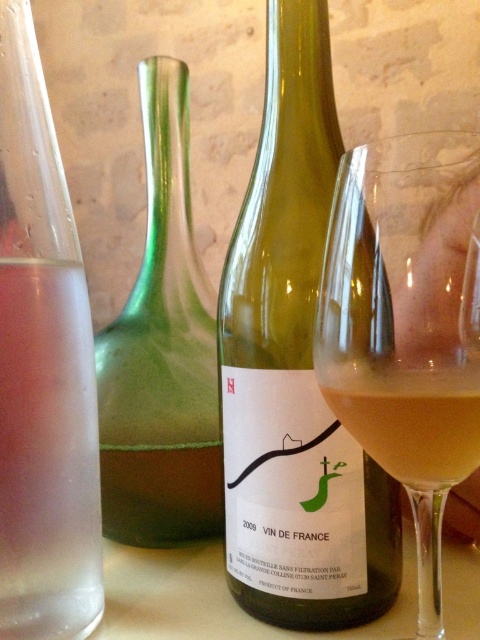
Can you confirm if transparent glass at left is bigger than green glass bottle at center?

Actually, transparent glass at left might be smaller than green glass bottle at center.

Based on the photo, who is more distant from viewer, (82, 356) or (162, 452)?

→ The point (162, 452) is more distant.

Image resolution: width=480 pixels, height=640 pixels. Identify the location of transparent glass at left. (43, 369).

From the picture: Who is shorter, green glass bottle at center or pale yellow liquid at glass right?

pale yellow liquid at glass right

You are a GUI agent. You are given a task and a screenshot of the screen. Output one action in this format:
    pyautogui.click(x=<x>, y=<y>)
    Task: Click on the green glass bottle at center
    The width and height of the screenshot is (480, 640).
    Given the screenshot: What is the action you would take?
    coord(162,353)

Where is `green glass bottle at center`? green glass bottle at center is located at coordinates (162, 353).

Describe the element at coordinates (407, 324) in the screenshot. Image resolution: width=480 pixels, height=640 pixels. I see `clear glass wine glass at center` at that location.

At what (x,y) coordinates should I click in order to perform the action: click on clear glass wine glass at center. Please return your answer as a coordinate pair (x, y). Image resolution: width=480 pixels, height=640 pixels. Looking at the image, I should click on (407, 324).

The height and width of the screenshot is (640, 480). What do you see at coordinates (407, 324) in the screenshot?
I see `clear glass wine glass at center` at bounding box center [407, 324].

You are a GUI agent. You are given a task and a screenshot of the screen. Output one action in this format:
    pyautogui.click(x=<x>, y=<y>)
    Task: Click on the clear glass wine glass at center
    
    Given the screenshot: What is the action you would take?
    pyautogui.click(x=407, y=324)